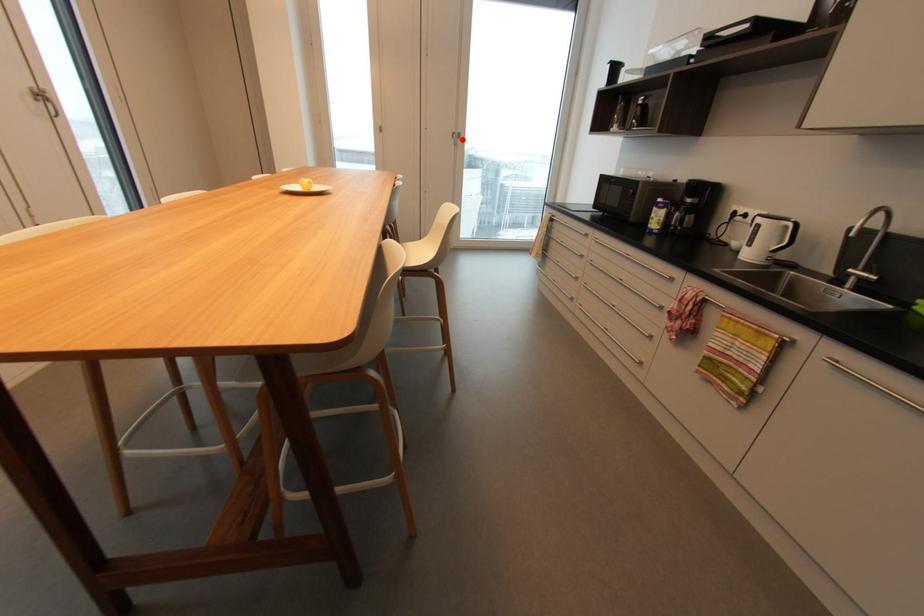
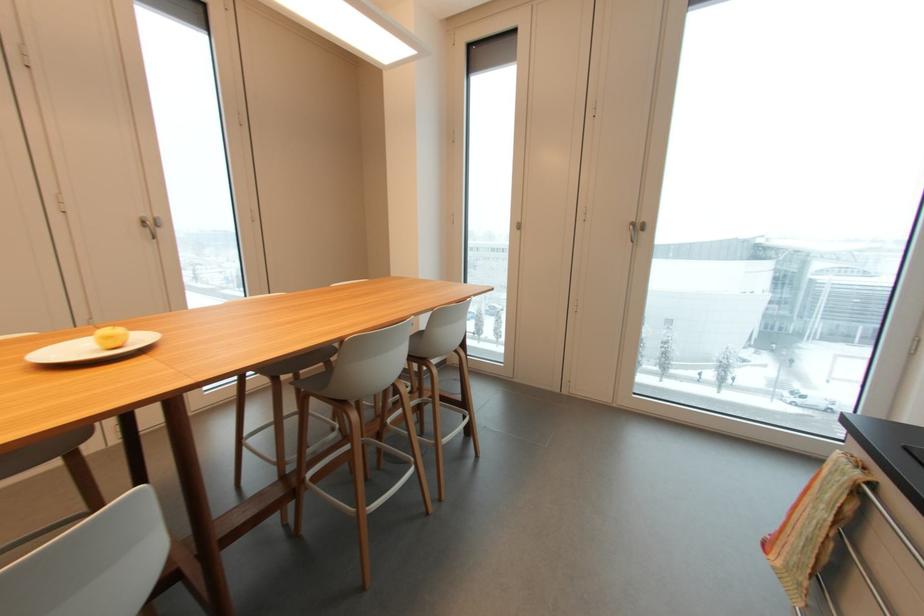
Locate, in the second image, the point that corresponds to the highlighted location in the first image.

(643, 233)